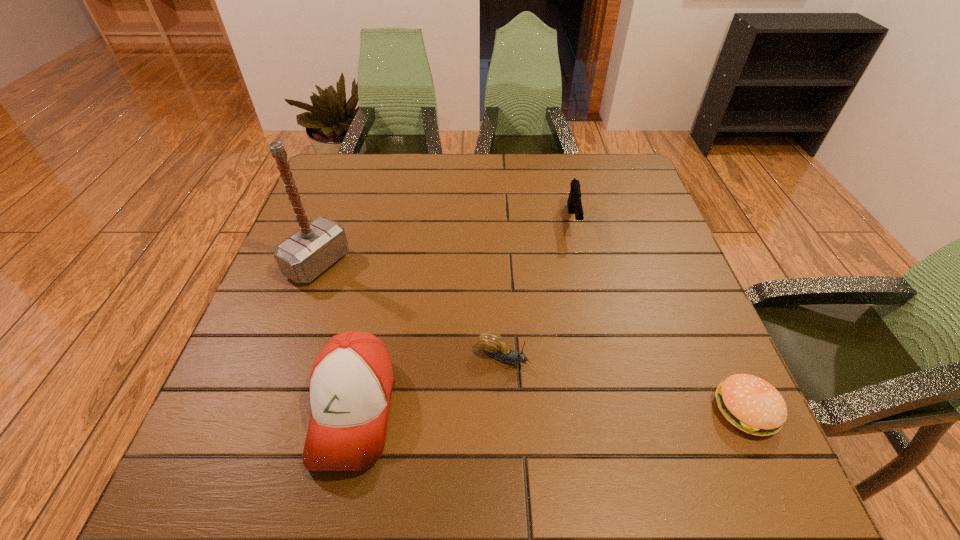
The width and height of the screenshot is (960, 540). I want to click on vacant space on the desktop that is between the second object from left to right and the patty and is positioned on the striking surface of the hammer, so point(593,410).

At what (x,y) coordinates should I click in order to perform the action: click on free space on the desktop that is between the fourth object from right to left and the rightmost object and is positioned on the front-facing side of the pistol. Please return your answer as a coordinate pair (x, y). This screenshot has height=540, width=960. Looking at the image, I should click on (598, 410).

What are the coordinates of `free space on the desktop that is between the fourth object from right to left and the patty and is positioned on the front-facing side of the escargot` in the screenshot? It's located at (608, 410).